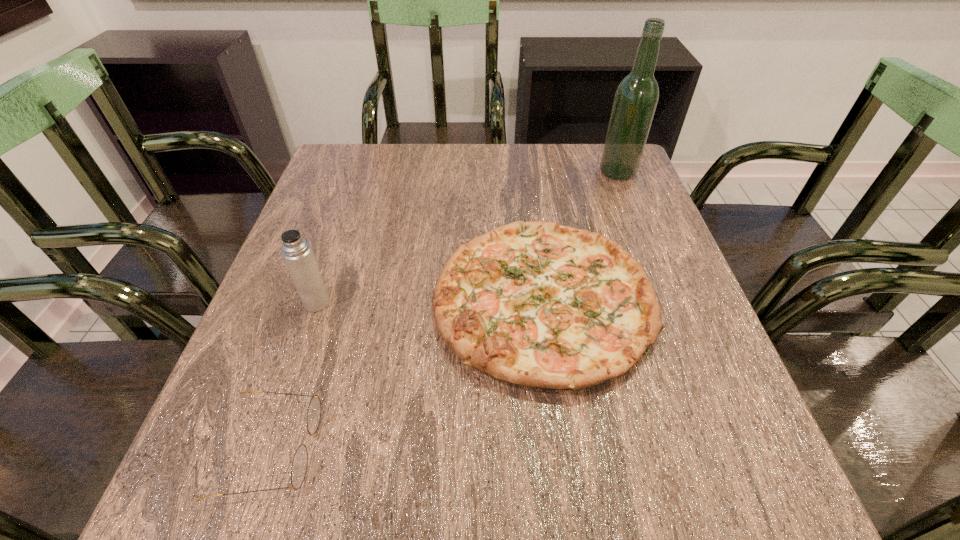
Locate an element on the screen. The height and width of the screenshot is (540, 960). the farthest object is located at coordinates (636, 98).

Locate an element on the screen. This screenshot has height=540, width=960. liquor is located at coordinates (636, 98).

I want to click on thermos bottle, so click(297, 253).

Find the location of a particular element. Image resolution: width=960 pixels, height=540 pixels. pizza is located at coordinates (537, 304).

This screenshot has width=960, height=540. What are the coordinates of `spectacles` in the screenshot? It's located at point(300,461).

Where is `vacant space situated on the front of the liquor`? Image resolution: width=960 pixels, height=540 pixels. vacant space situated on the front of the liquor is located at coordinates (634, 213).

The height and width of the screenshot is (540, 960). What are the coordinates of `vacant space situated 0.240m on the right of the second tallest object` in the screenshot? It's located at (449, 302).

The width and height of the screenshot is (960, 540). In order to click on vacant area situated 0.050m on the back of the pizza in this screenshot , I will do `click(532, 217)`.

Find the location of a particular element. vacant region located on the temples of the nearest object is located at coordinates (480, 448).

Locate an element on the screen. object located at the far edge is located at coordinates (636, 98).